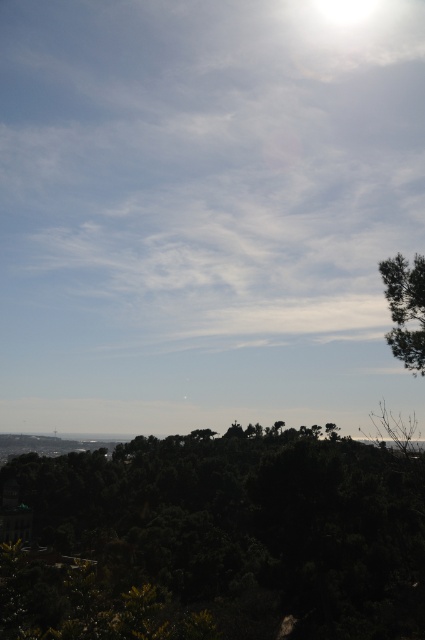
Question: Can you confirm if dark green leafy tree at center is wider than green leafy tree at upper right?

Choices:
 (A) no
 (B) yes

Answer: (B)

Question: Which point is closer to the camera?

Choices:
 (A) click(410, 273)
 (B) click(393, 625)

Answer: (A)

Question: Which point is closer to the camera taking this photo?

Choices:
 (A) (379, 634)
 (B) (413, 352)

Answer: (B)

Question: Considering the relative positions of dark green leafy tree at center and green leafy tree at upper right in the image provided, where is dark green leafy tree at center located with respect to green leafy tree at upper right?

Choices:
 (A) right
 (B) left

Answer: (B)

Question: Observing the image, what is the correct spatial positioning of dark green leafy tree at center in reference to green leafy tree at upper right?

Choices:
 (A) right
 (B) left

Answer: (B)